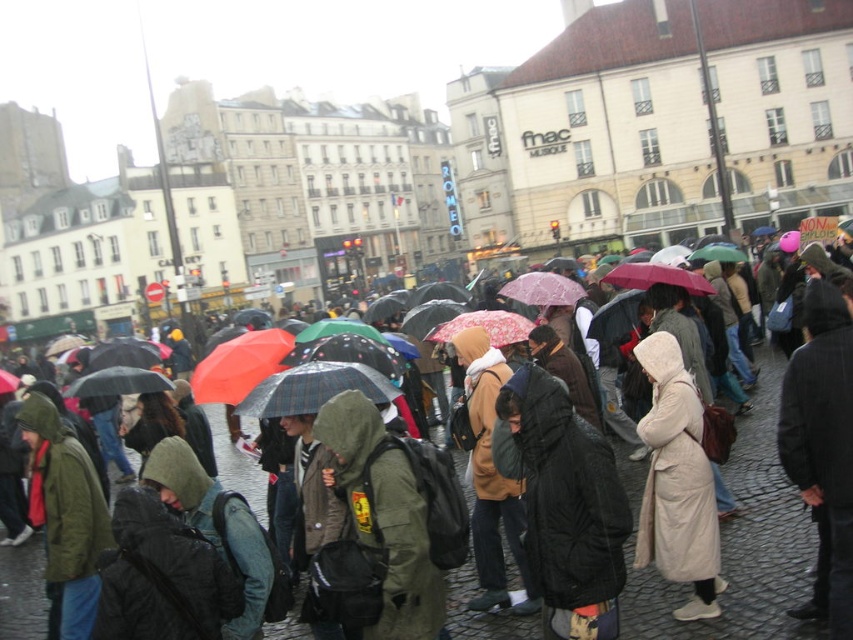
You are a delivery person with a cart that is 2 meters wide. You need to move from the cobblestone pavement at center to the light beige coat at center. Is there enough space for your cart to pass through the path between them?

The distance between the cobblestone pavement at center and the light beige coat at center is 6.61 meters. Since the cart is only 2 meters wide, there is sufficient space for the cart to pass through the path between them.

You are a delivery person carrying a large package that requires placing on the cobblestone pavement at center. However, there is a light beige coat at center in the way. Can you place the package there without moving the coat?

The cobblestone pavement at center is bigger than the light beige coat at center, so yes, you can place the package there without moving the coat because there is enough space around the light beige coat at center on the larger cobblestone pavement at center.